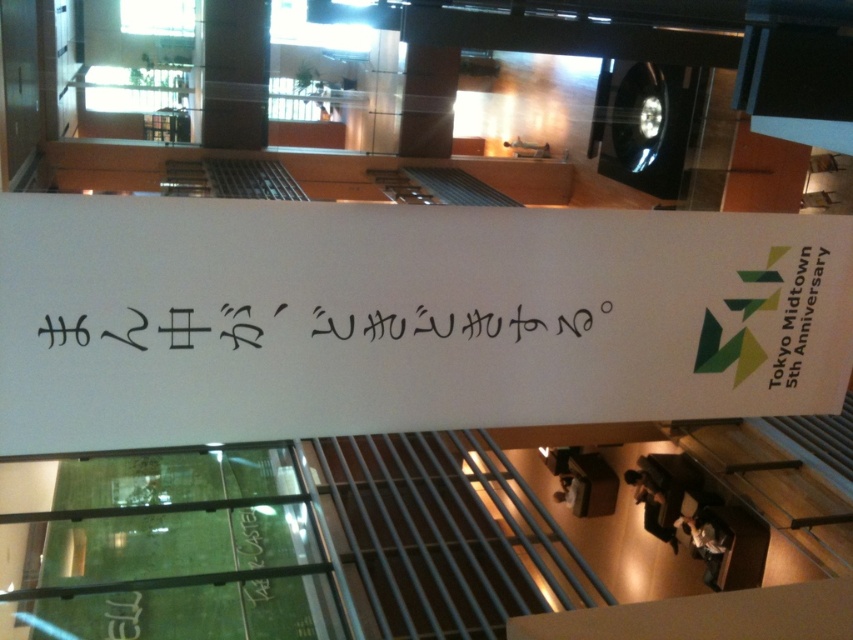
This screenshot has height=640, width=853. Identify the location of white paper sign at center. (393, 317).

Between point (120, 323) and point (231, 324), which one is positioned in front?

Point (120, 323)

Locate an element on the screen. The height and width of the screenshot is (640, 853). white paper sign at center is located at coordinates (393, 317).

You are a GUI agent. You are given a task and a screenshot of the screen. Output one action in this format:
    pyautogui.click(x=<x>, y=<y>)
    Task: Click on the white paper sign at center
    This screenshot has height=640, width=853.
    Given the screenshot: What is the action you would take?
    pos(393,317)

Is the position of black calligraphy at center more distant than that of white paper at upper right?

No, black calligraphy at center is closer to the viewer.

Is black calligraphy at center below white paper at upper right?

Yes.

Describe the element at coordinates (445, 324) in the screenshot. I see `black calligraphy at center` at that location.

Locate an element on the screen. Image resolution: width=853 pixels, height=640 pixels. black calligraphy at center is located at coordinates (445, 324).

Can you confirm if white paper sign at center is smaller than white paper at upper right?

Actually, white paper sign at center might be larger than white paper at upper right.

Between point (346, 348) and point (785, 364), which one is positioned behind?

Positioned behind is point (785, 364).

Locate an element on the screen. white paper sign at center is located at coordinates (393, 317).

Identify the location of white paper sign at center. (393, 317).